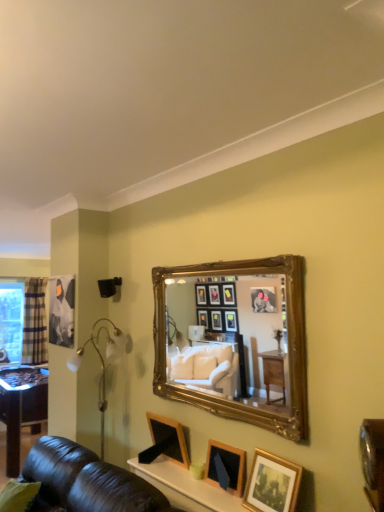
How much space does gold-framed photo at lower right, acting as the third picture frame starting from the left, occupy vertically?

The height of gold-framed photo at lower right, acting as the third picture frame starting from the left, is 12.21 inches.

Describe the element at coordinates (227, 466) in the screenshot. I see `wooden picture frame at lower center, which ranks as the 2th picture frame in front-to-back order` at that location.

The width and height of the screenshot is (384, 512). Describe the element at coordinates (228, 340) in the screenshot. I see `gold-framed mirror at upper center` at that location.

Locate an element on the screen. The width and height of the screenshot is (384, 512). wooden picture frame at lower center, the 3th picture frame from the front is located at coordinates (168, 436).

Considering the sizes of clear plastic window screen at left and wooden picture frame at lower center, the first picture frame in the back-to-front sequence, in the image, is clear plastic window screen at left taller or shorter than wooden picture frame at lower center, the first picture frame in the back-to-front sequence,?

clear plastic window screen at left is taller than wooden picture frame at lower center, the first picture frame in the back-to-front sequence.

From a real-world perspective, which is physically below, clear plastic window screen at left or wooden picture frame at lower center, marked as the 3th picture frame in a right-to-left arrangement?

wooden picture frame at lower center, marked as the 3th picture frame in a right-to-left arrangement, is physically lower.

Which object is closer to the camera, clear plastic window screen at left or wooden picture frame at lower center, marked as the 3th picture frame in a right-to-left arrangement?

wooden picture frame at lower center, marked as the 3th picture frame in a right-to-left arrangement, is in front.

In terms of width, does clear plastic window screen at left look wider or thinner when compared to wooden picture frame at lower center, marked as the 3th picture frame in a right-to-left arrangement?

clear plastic window screen at left is wider than wooden picture frame at lower center, marked as the 3th picture frame in a right-to-left arrangement.

Image resolution: width=384 pixels, height=512 pixels. Identify the location of window screen behind the wooden picture frame at lower center, the second picture frame positioned from the left. (11, 321).

From their relative heights in the image, would you say clear plastic window screen at left is taller or shorter than wooden picture frame at lower center, arranged as the second picture frame when viewed from the right?

Considering their sizes, clear plastic window screen at left has more height than wooden picture frame at lower center, arranged as the second picture frame when viewed from the right.

Is clear plastic window screen at left oriented away from wooden picture frame at lower center, arranged as the second picture frame when viewed from the right?

No, clear plastic window screen at left is not facing away from wooden picture frame at lower center, arranged as the second picture frame when viewed from the right.

Does clear plastic window screen at left appear on the right side of wooden picture frame at lower center, which ranks as the 2th picture frame in front-to-back order?

No, clear plastic window screen at left is not to the right of wooden picture frame at lower center, which ranks as the 2th picture frame in front-to-back order.

Considering the relative sizes of plaid fabric curtain at left and clear plastic window screen at left in the image provided, is plaid fabric curtain at left smaller than clear plastic window screen at left?

Indeed, plaid fabric curtain at left has a smaller size compared to clear plastic window screen at left.

Are plaid fabric curtain at left and clear plastic window screen at left located far from each other?

No, there isn't a large distance between plaid fabric curtain at left and clear plastic window screen at left.

Can you tell me how much plaid fabric curtain at left and clear plastic window screen at left differ in facing direction?

The angular difference between plaid fabric curtain at left and clear plastic window screen at left is 3.91 degrees.

Is plaid fabric curtain at left inside the boundaries of clear plastic window screen at left, or outside?

A: The correct answer is: outside.

Does point (280, 465) come farther from viewer compared to point (207, 450)?

No, (280, 465) is closer to viewer.

Is gold-framed photo at lower right, acting as the third picture frame starting from the left, wider than wooden picture frame at lower center, the second picture frame positioned from the left?

No, gold-framed photo at lower right, acting as the third picture frame starting from the left, is not wider than wooden picture frame at lower center, the second picture frame positioned from the left.

Are gold-framed photo at lower right, the 1th picture frame positioned from the right, and wooden picture frame at lower center, the second picture frame positioned from the left, far apart?

They are positioned close to each other.

From the image's perspective, is wooden picture frame at lower center, which ranks as the 2th picture frame in front-to-back order, positioned above or below clear plastic window screen at left?

wooden picture frame at lower center, which ranks as the 2th picture frame in front-to-back order, is situated lower than clear plastic window screen at left in the image.

You are a GUI agent. You are given a task and a screenshot of the screen. Output one action in this format:
    pyautogui.click(x=<x>, y=<y>)
    Task: Click on the window screen above the wooden picture frame at lower center, which ranks as the 2th picture frame in front-to-back order (from the image's perspective)
    
    Given the screenshot: What is the action you would take?
    pyautogui.click(x=11, y=321)

Can you confirm if wooden picture frame at lower center, the second picture frame positioned from the left, is bigger than clear plastic window screen at left?

Incorrect, wooden picture frame at lower center, the second picture frame positioned from the left, is not larger than clear plastic window screen at left.

Can you confirm if wooden picture frame at lower center, which appears as the second picture frame when viewed from the back, is shorter than clear plastic window screen at left?

Indeed, wooden picture frame at lower center, which appears as the second picture frame when viewed from the back, has a lesser height compared to clear plastic window screen at left.

Does point (218, 443) come behind point (291, 489)?

Yes.

Which is more to the left, wooden picture frame at lower center, arranged as the second picture frame when viewed from the right, or gold-framed photo at lower right, the 1th picture frame positioned from the right?

From the viewer's perspective, wooden picture frame at lower center, arranged as the second picture frame when viewed from the right, appears more on the left side.

Is wooden picture frame at lower center, which ranks as the 2th picture frame in front-to-back order, surrounding gold-framed photo at lower right, the 1th picture frame positioned from the right?

No, gold-framed photo at lower right, the 1th picture frame positioned from the right, is not surrounded by wooden picture frame at lower center, which ranks as the 2th picture frame in front-to-back order.

Considering the sizes of objects clear plastic window screen at left and gold-framed photo at lower right, acting as the third picture frame starting from the left, in the image provided, who is taller, clear plastic window screen at left or gold-framed photo at lower right, acting as the third picture frame starting from the left,?

clear plastic window screen at left.

Which is nearer, (14, 284) or (280, 507)?

Result: Point (14, 284).

Is the surface of clear plastic window screen at left in direct contact with gold-framed photo at lower right, the 1th picture frame positioned from the right?

No, clear plastic window screen at left is not making contact with gold-framed photo at lower right, the 1th picture frame positioned from the right.

Is gold-framed photo at lower right, the 1th picture frame positioned from the right, inside clear plastic window screen at left?

No, clear plastic window screen at left does not contain gold-framed photo at lower right, the 1th picture frame positioned from the right.

From the clear plastic window screen at left, count 1st picture frame to the right and point to it. Please provide its 2D coordinates.

[(168, 436)]

Locate an element on the screen. the 2nd picture frame in front when counting from the clear plastic window screen at left is located at coordinates (227, 466).

Based on their spatial positions, is wooden picture frame at lower center, marked as the 3th picture frame in a right-to-left arrangement, or wooden picture frame at lower center, the second picture frame positioned from the left, closer to gold-framed photo at lower right, the 1th picture frame positioned from the right?

Among the two, wooden picture frame at lower center, the second picture frame positioned from the left, is located nearer to gold-framed photo at lower right, the 1th picture frame positioned from the right.

Looking at the image, which one is located further to gold-framed photo at lower right, the third picture frame in the back-to-front sequence, clear plastic window screen at left or plaid fabric curtain at left?

Based on the image, clear plastic window screen at left appears to be further to gold-framed photo at lower right, the third picture frame in the back-to-front sequence.

Based on the photo, based on their spatial positions, is gold-framed mirror at upper center or wooden picture frame at lower center, the first picture frame in the back-to-front sequence, closer to gold-framed photo at lower right, the third picture frame in the back-to-front sequence?

The object closer to gold-framed photo at lower right, the third picture frame in the back-to-front sequence, is gold-framed mirror at upper center.

From the image, which object appears to be nearer to wooden picture frame at lower center, which appears as the second picture frame when viewed from the back, clear plastic window screen at left or gold-framed mirror at upper center?

The object closer to wooden picture frame at lower center, which appears as the second picture frame when viewed from the back, is gold-framed mirror at upper center.

Looking at the image, which one is located further to gold-framed mirror at upper center, plaid fabric curtain at left or wooden picture frame at lower center, which ranks as the 2th picture frame in front-to-back order?

plaid fabric curtain at left lies further to gold-framed mirror at upper center than the other object.

When comparing their distances from clear plastic window screen at left, does wooden picture frame at lower center, which appears as the second picture frame when viewed from the back, or gold-framed mirror at upper center seem closer?

The object closer to clear plastic window screen at left is gold-framed mirror at upper center.

Which object lies nearer to the anchor point wooden picture frame at lower center, the second picture frame positioned from the left, plaid fabric curtain at left or wooden picture frame at lower center, marked as the 3th picture frame in a right-to-left arrangement?

wooden picture frame at lower center, marked as the 3th picture frame in a right-to-left arrangement, is closer to wooden picture frame at lower center, the second picture frame positioned from the left.

Estimate the real-world distances between objects in this image. Which object is further from gold-framed mirror at upper center, wooden picture frame at lower center, arranged as the second picture frame when viewed from the right, or plaid fabric curtain at left?

The object further to gold-framed mirror at upper center is plaid fabric curtain at left.

Locate an element on the screen. mirror positioned between gold-framed photo at lower right, positioned as the first picture frame in front-to-back order, and clear plastic window screen at left from near to far is located at coordinates coord(228,340).

You are a GUI agent. You are given a task and a screenshot of the screen. Output one action in this format:
    pyautogui.click(x=<x>, y=<y>)
    Task: Click on the curtain between gold-framed mirror at upper center and clear plastic window screen at left in the front-back direction
    This screenshot has width=384, height=512.
    Given the screenshot: What is the action you would take?
    pyautogui.click(x=35, y=322)

I want to click on picture frame between gold-framed mirror at upper center and wooden picture frame at lower center, which is the first picture frame from left to right, in the up-down direction, so click(x=272, y=484).

Image resolution: width=384 pixels, height=512 pixels. I want to click on curtain between wooden picture frame at lower center, marked as the 3th picture frame in a right-to-left arrangement, and clear plastic window screen at left, along the z-axis, so click(x=35, y=322).